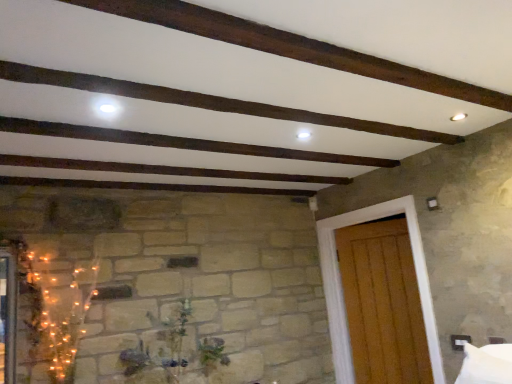
Find the location of a particular element. This screenshot has height=384, width=512. wooden door at right is located at coordinates (341, 283).

The image size is (512, 384). What do you see at coordinates (341, 283) in the screenshot?
I see `wooden door at right` at bounding box center [341, 283].

This screenshot has height=384, width=512. What do you see at coordinates (162, 348) in the screenshot?
I see `green matte plant at center` at bounding box center [162, 348].

Find the location of a particular element. This screenshot has width=512, height=384. green matte plant at center is located at coordinates (162, 348).

Locate an element on the screen. The image size is (512, 384). wooden door at right is located at coordinates (341, 283).

Can you confirm if green matte plant at center is positioned to the right of wooden door at right?

No, green matte plant at center is not to the right of wooden door at right.

Is green matte plant at center closer to camera compared to wooden door at right?

Yes, the depth of green matte plant at center is less than that of wooden door at right.

Which is nearer, (228, 358) or (419, 261)?

Point (228, 358) is positioned farther from the camera compared to point (419, 261).

From the image's perspective, which one is positioned lower, green matte plant at center or wooden door at right?

From the image's view, green matte plant at center is below.

From a real-world perspective, is green matte plant at center physically below wooden door at right?

Yes, from a real-world perspective, green matte plant at center is beneath wooden door at right.

From the picture: Between green matte plant at center and wooden door at right, which one has smaller width?

Thinner between the two is wooden door at right.

Is green matte plant at center shorter than wooden door at right?

Yes.

Which of these two, green matte plant at center or wooden door at right, is bigger?

wooden door at right is bigger.

Would you say green matte plant at center is inside or outside wooden door at right?

green matte plant at center exists outside the volume of wooden door at right.

Is green matte plant at center in contact with wooden door at right?

No, green matte plant at center is not next to wooden door at right.

Is green matte plant at center oriented away from wooden door at right?

No, green matte plant at center's orientation is not away from wooden door at right.

In the scene shown: How far apart are green matte plant at center and wooden door at right?

They are 4.25 feet apart.

You are a GUI agent. You are given a task and a screenshot of the screen. Output one action in this format:
    pyautogui.click(x=<x>, y=<y>)
    Task: Click on the door that is above the green matte plant at center (from the image's perspective)
    The height and width of the screenshot is (384, 512).
    Given the screenshot: What is the action you would take?
    pyautogui.click(x=341, y=283)

Which object is positioned more to the right, wooden door at right or green matte plant at center?

wooden door at right is more to the right.

Between wooden door at right and green matte plant at center, which one is positioned in front?

green matte plant at center is more forward.

Is point (352, 217) positioned in front of point (159, 364)?

No, (352, 217) is behind (159, 364).

From the image's perspective, is wooden door at right positioned above or below green matte plant at center?

From the image's perspective, wooden door at right appears above green matte plant at center.

From a real-world perspective, which object stands above the other?

In real-world perspective, wooden door at right is above.

Can you confirm if wooden door at right is wider than green matte plant at center?

No, wooden door at right is not wider than green matte plant at center.

Who is taller, wooden door at right or green matte plant at center?

Standing taller between the two is wooden door at right.

Is wooden door at right bigger than green matte plant at center?

Yes, wooden door at right is bigger than green matte plant at center.

Would you say wooden door at right contains green matte plant at center?

That's incorrect, green matte plant at center is not inside wooden door at right.

Is wooden door at right beside green matte plant at center?

wooden door at right and green matte plant at center are clearly separated.

Is wooden door at right facing towards green matte plant at center?

Yes, wooden door at right is oriented towards green matte plant at center.

What's the angular difference between wooden door at right and green matte plant at center's facing directions?

92.7 degrees.

Measure the distance between wooden door at right and green matte plant at center.

1.30 meters.

You are a GUI agent. You are given a task and a screenshot of the screen. Output one action in this format:
    pyautogui.click(x=<x>, y=<y>)
    Task: Click on the door on the right of green matte plant at center
    The height and width of the screenshot is (384, 512).
    Given the screenshot: What is the action you would take?
    pyautogui.click(x=341, y=283)

Find the location of a particular element. This screenshot has width=512, height=384. door lying behind the green matte plant at center is located at coordinates 341,283.

The width and height of the screenshot is (512, 384). What are the coordinates of `door above the green matte plant at center (from the image's perspective)` in the screenshot? It's located at (341, 283).